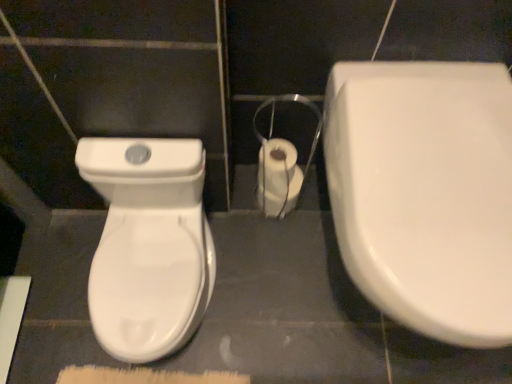
Where is `free space above white glossy toilet at right, which appears as the 2th toilet when viewed from the left (from a real-world perspective)`? free space above white glossy toilet at right, which appears as the 2th toilet when viewed from the left (from a real-world perspective) is located at coordinates (457, 189).